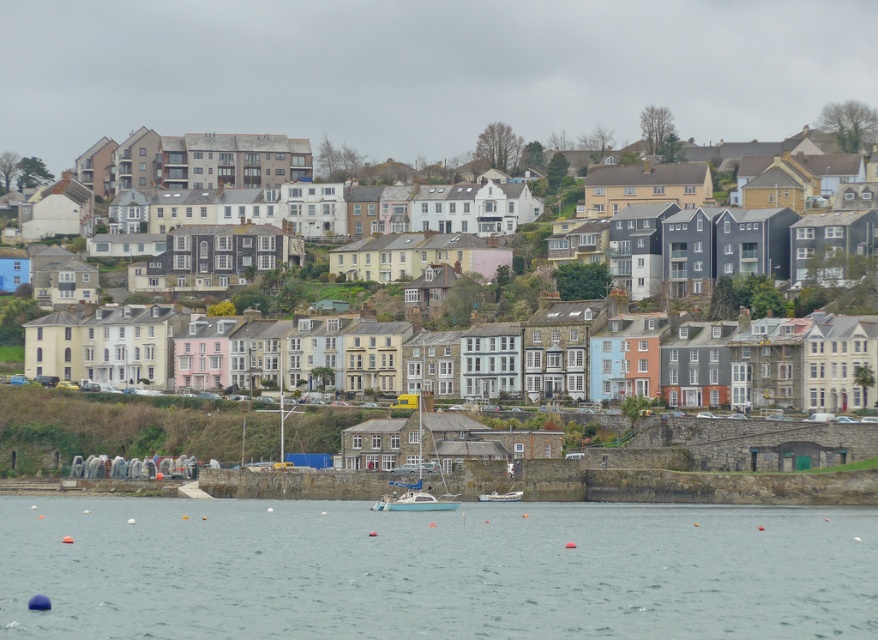
Is the position of clear water at lower center less distant than that of white plastic boat at center?

Yes, it is.

Who is positioned more to the right, clear water at lower center or white plastic boat at center?

Positioned to the right is white plastic boat at center.

Does point (714, 592) lie in front of point (500, 493)?

Yes, it is in front of point (500, 493).

At what (x,y) coordinates should I click in order to perform the action: click on clear water at lower center. Please return your answer as a coordinate pair (x, y). Looking at the image, I should click on (433, 570).

Looking at this image, who is higher up, clear water at lower center or light blue plastic boat at center?

light blue plastic boat at center is higher up.

Is clear water at lower center above light blue plastic boat at center?

No, clear water at lower center is not above light blue plastic boat at center.

Find the location of a particular element. Image resolution: width=878 pixels, height=640 pixels. clear water at lower center is located at coordinates (433, 570).

Which is below, light blue plastic boat at center or white plastic boat at center?

white plastic boat at center is lower down.

Identify the location of light blue plastic boat at center. (416, 500).